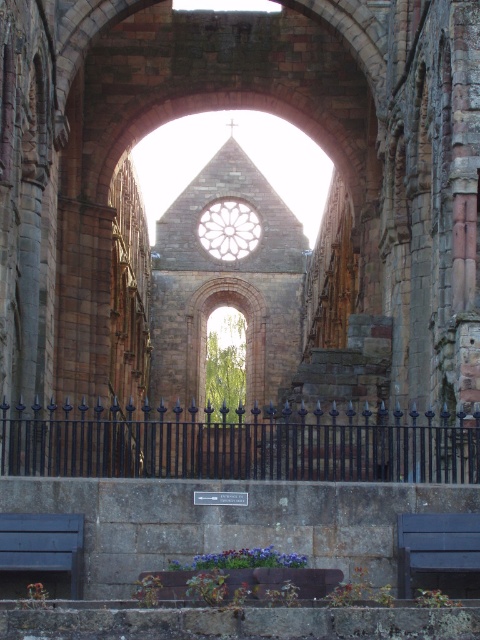
Question: Where is blue painted wood bench at lower left located in relation to dark blue wood bench at lower right in the image?

Choices:
 (A) left
 (B) right

Answer: (A)

Question: Which of the following is the farthest from the observer?

Choices:
 (A) blue painted wood bench at lower left
 (B) dark blue wood bench at lower right

Answer: (B)

Question: Considering the relative positions of blue painted wood bench at lower left and dark blue wood bench at lower right in the image provided, where is blue painted wood bench at lower left located with respect to dark blue wood bench at lower right?

Choices:
 (A) left
 (B) right

Answer: (A)

Question: Which point is closer to the camera?

Choices:
 (A) dark blue wood bench at lower right
 (B) blue painted wood bench at lower left

Answer: (B)

Question: Is blue painted wood bench at lower left thinner than dark blue wood bench at lower right?

Choices:
 (A) yes
 (B) no

Answer: (B)